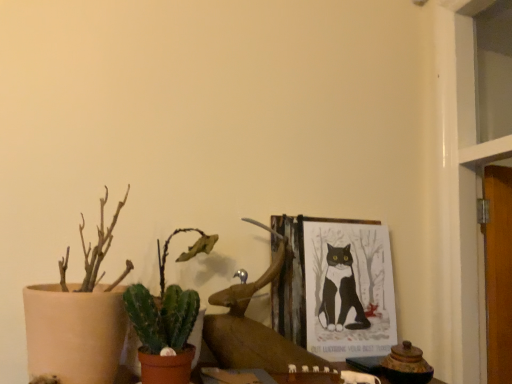
Question: Is green succulent at lower left positioned behind matte beige pot at left, the second houseplant from the right?

Choices:
 (A) yes
 (B) no

Answer: (A)

Question: From a real-world perspective, is green succulent at lower left on top of matte beige pot at left, the second houseplant from the right?

Choices:
 (A) no
 (B) yes

Answer: (A)

Question: Can you confirm if green succulent at lower left is positioned to the right of matte beige pot at left, the first houseplant from the left?

Choices:
 (A) yes
 (B) no

Answer: (A)

Question: Would you say green succulent at lower left is a long distance from matte beige pot at left, the second houseplant from the right?

Choices:
 (A) no
 (B) yes

Answer: (A)

Question: Considering the relative sizes of green succulent at lower left and matte beige pot at left, the first houseplant from the left, in the image provided, is green succulent at lower left thinner than matte beige pot at left, the first houseplant from the left,?

Choices:
 (A) no
 (B) yes

Answer: (B)

Question: Is green succulent at lower left turned away from matte beige pot at left, the first houseplant from the left?

Choices:
 (A) yes
 (B) no

Answer: (B)

Question: From a real-world perspective, is green matte cactus at lower left, marked as the first houseplant in a right-to-left arrangement, positioned under green succulent at lower left based on gravity?

Choices:
 (A) yes
 (B) no

Answer: (B)

Question: Is the position of green matte cactus at lower left, the 2th houseplant positioned from the left, less distant than that of green succulent at lower left?

Choices:
 (A) no
 (B) yes

Answer: (A)

Question: From a real-world perspective, is green matte cactus at lower left, marked as the first houseplant in a right-to-left arrangement, on green succulent at lower left?

Choices:
 (A) no
 (B) yes

Answer: (B)

Question: Are green matte cactus at lower left, the 2th houseplant positioned from the left, and green succulent at lower left far apart?

Choices:
 (A) no
 (B) yes

Answer: (A)

Question: Is green matte cactus at lower left, marked as the first houseplant in a right-to-left arrangement, thinner than green succulent at lower left?

Choices:
 (A) yes
 (B) no

Answer: (B)

Question: Can you confirm if green matte cactus at lower left, the 2th houseplant positioned from the left, is positioned to the left of green succulent at lower left?

Choices:
 (A) yes
 (B) no

Answer: (A)

Question: Is wooden picture frame at upper center facing away from matte beige pot at left, the second houseplant from the right?

Choices:
 (A) no
 (B) yes

Answer: (A)